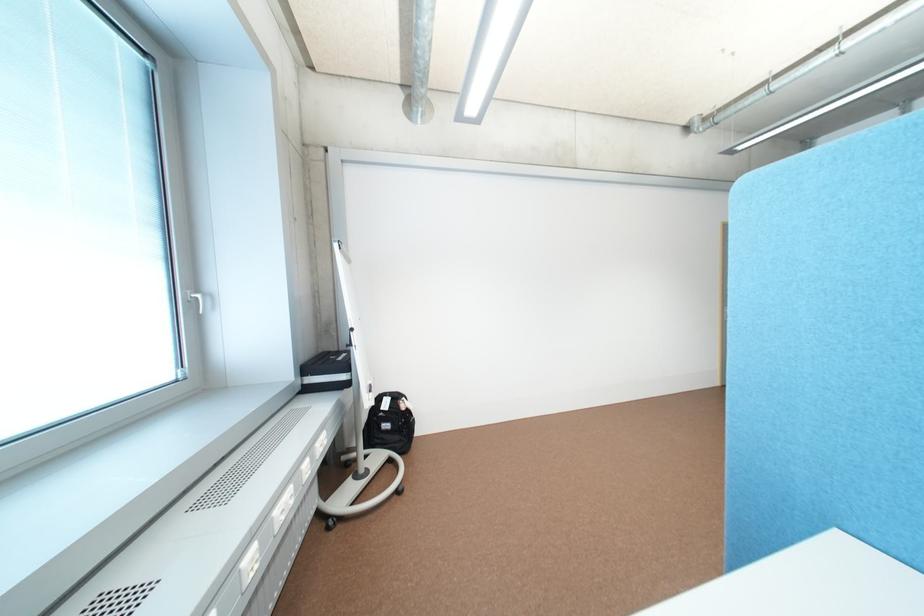
Find the location of a particular element. white window handle is located at coordinates tap(197, 301).